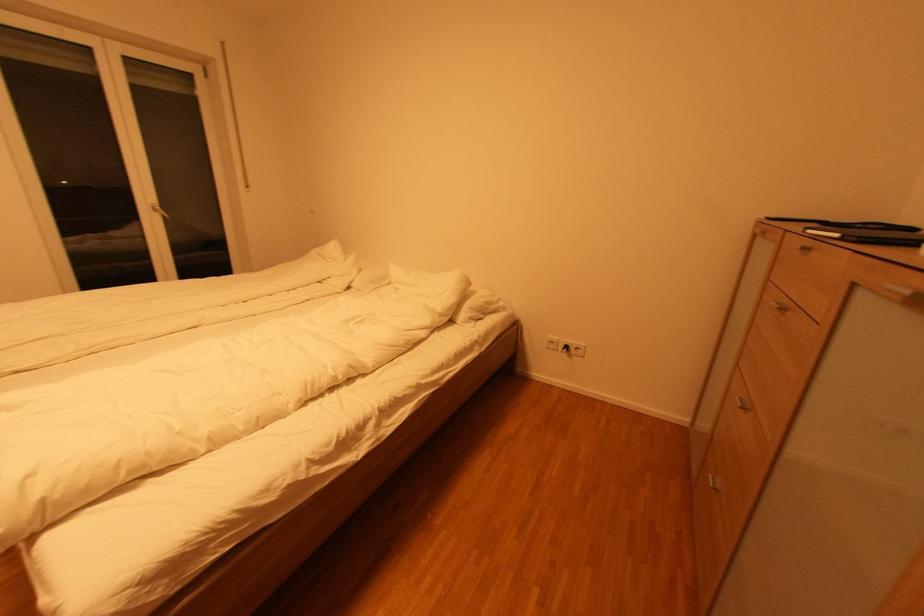
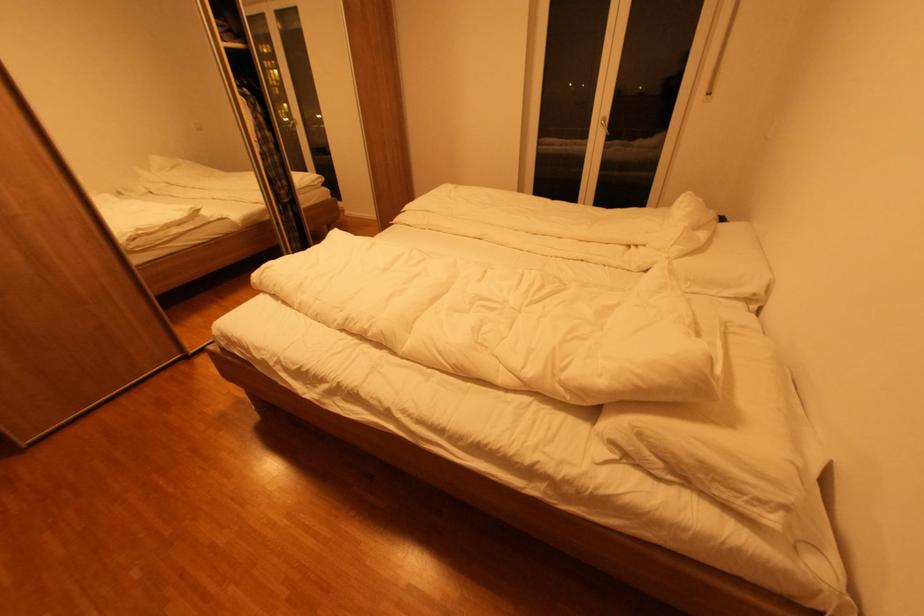
Where in the second image is the point corresponding to pixel 366 272 from the first image?

(697, 254)